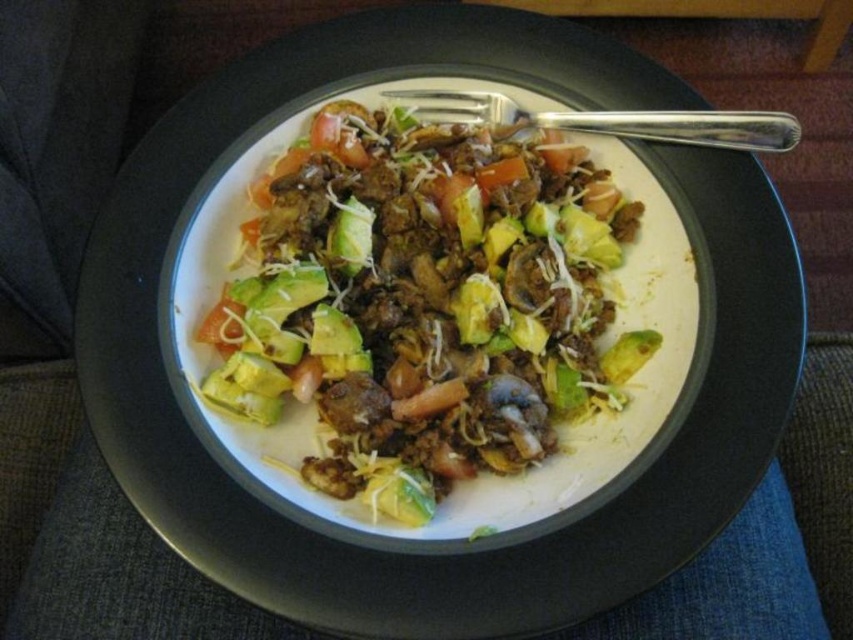
Between shiny avocado salad at center and satin silver fork at upper right, which one is positioned higher?

satin silver fork at upper right

From the picture: Does shiny avocado salad at center have a lesser height compared to satin silver fork at upper right?

In fact, shiny avocado salad at center may be taller than satin silver fork at upper right.

What do you see at coordinates (424, 310) in the screenshot? Image resolution: width=853 pixels, height=640 pixels. I see `shiny avocado salad at center` at bounding box center [424, 310].

You are a GUI agent. You are given a task and a screenshot of the screen. Output one action in this format:
    pyautogui.click(x=<x>, y=<y>)
    Task: Click on the shiny avocado salad at center
    The height and width of the screenshot is (640, 853).
    Given the screenshot: What is the action you would take?
    pyautogui.click(x=424, y=310)

This screenshot has height=640, width=853. What do you see at coordinates (424, 310) in the screenshot?
I see `shiny avocado salad at center` at bounding box center [424, 310].

Between point (265, 417) and point (341, 259), which one is positioned in front?

Point (265, 417)

What do you see at coordinates (424, 310) in the screenshot? Image resolution: width=853 pixels, height=640 pixels. I see `shiny avocado salad at center` at bounding box center [424, 310].

Where is `shiny avocado salad at center`? shiny avocado salad at center is located at coordinates (424, 310).

Who is lower down, satin silver fork at upper right or green avocado at center?

Positioned lower is green avocado at center.

Between satin silver fork at upper right and green avocado at center, which one is positioned higher?

satin silver fork at upper right

Describe the element at coordinates (611, 120) in the screenshot. I see `satin silver fork at upper right` at that location.

Locate an element on the screen. The height and width of the screenshot is (640, 853). satin silver fork at upper right is located at coordinates (611, 120).